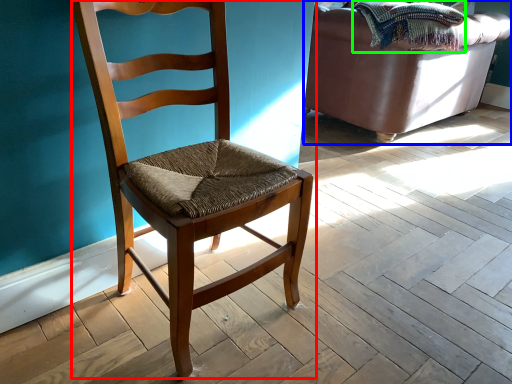
Question: Based on their relative distances, which object is nearer to chair (highlighted by a red box)? Choose from studio couch (highlighted by a blue box) and blanket (highlighted by a green box).

Choices:
 (A) studio couch
 (B) blanket

Answer: (B)